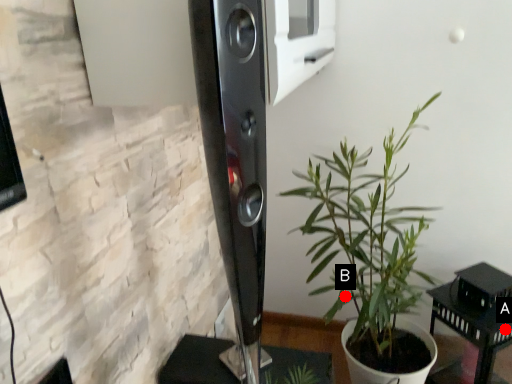
Question: Two points are circled on the image, labeled by A and B beside each circle. Which of the following is the farthest from the observer?

Choices:
 (A) A is further
 (B) B is further

Answer: (A)